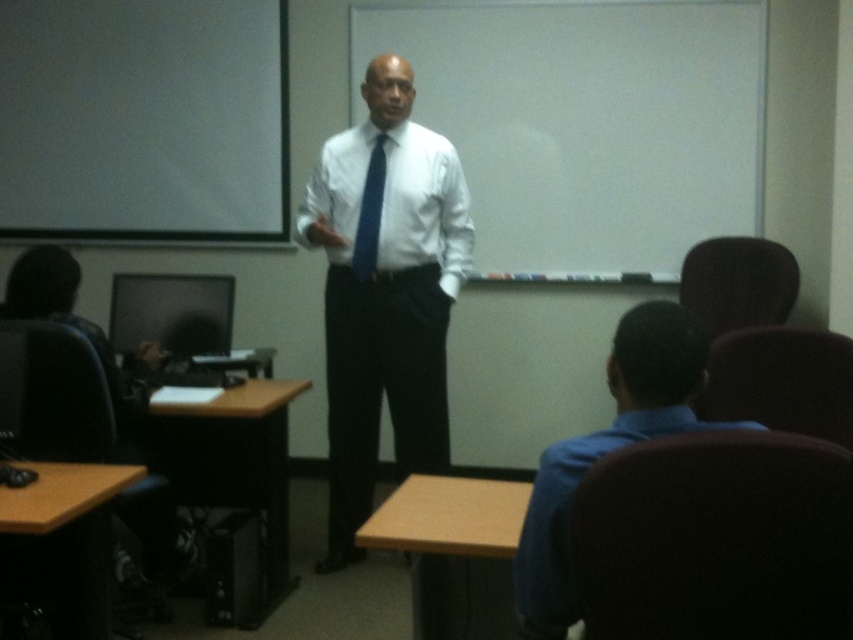
Image resolution: width=853 pixels, height=640 pixels. In order to click on white glossy shirt at center in this screenshot , I will do `click(384, 291)`.

Is white glossy shirt at center to the right of matte black monitor at left from the viewer's perspective?

Correct, you'll find white glossy shirt at center to the right of matte black monitor at left.

Image resolution: width=853 pixels, height=640 pixels. In order to click on white glossy shirt at center in this screenshot , I will do `click(384, 291)`.

Locate an element on the screen. white glossy shirt at center is located at coordinates (384, 291).

Consider the image. Between blue shirt at lower right and white smooth shirt at center, which one has less height?

With less height is blue shirt at lower right.

Is blue shirt at lower right closer to camera compared to white smooth shirt at center?

That is True.

Is point (576, 474) positioned in front of point (409, 266)?

Yes.

Locate an element on the screen. blue shirt at lower right is located at coordinates coord(608,451).

Is white smooth shirt at center further to camera compared to blue silk tie at center?

No, it is not.

Is white smooth shirt at center bigger than blue silk tie at center?

Yes, white smooth shirt at center is bigger than blue silk tie at center.

Is point (407, 157) farther from camera compared to point (376, 157)?

That is False.

Find the location of `white smooth shirt at center`. white smooth shirt at center is located at coordinates (424, 208).